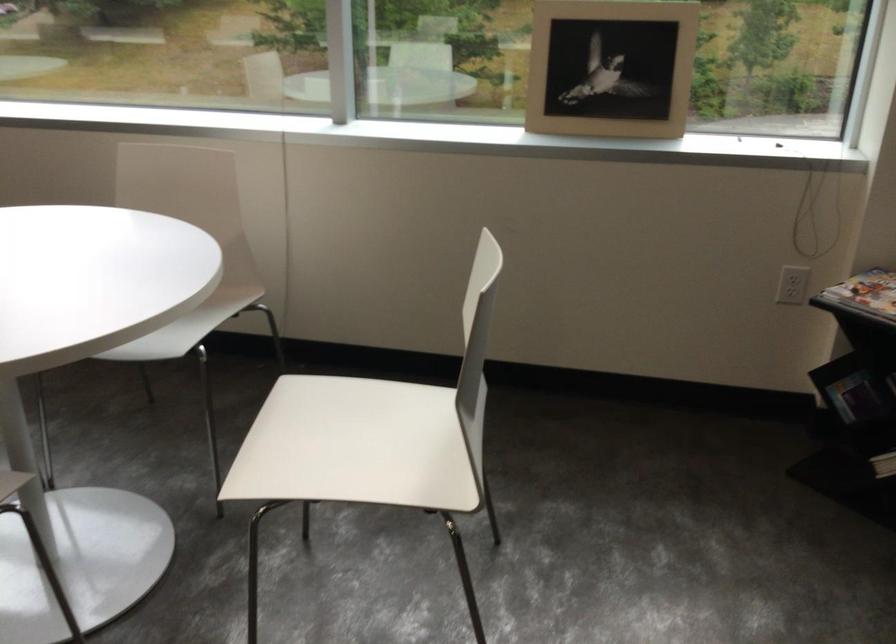
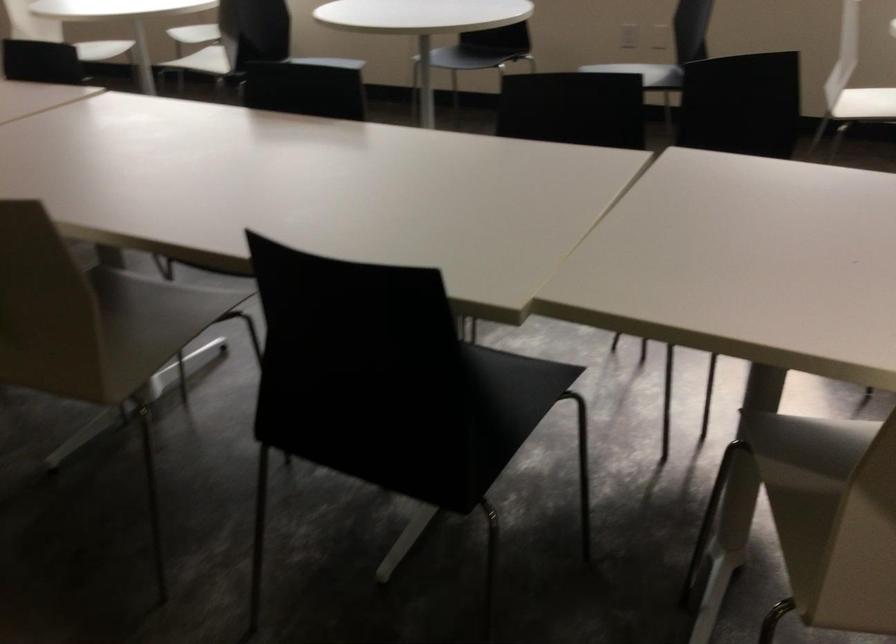
In a continuous first-person perspective shot, in which direction is the camera moving?

The movement direction of the cameraman is left, backward.